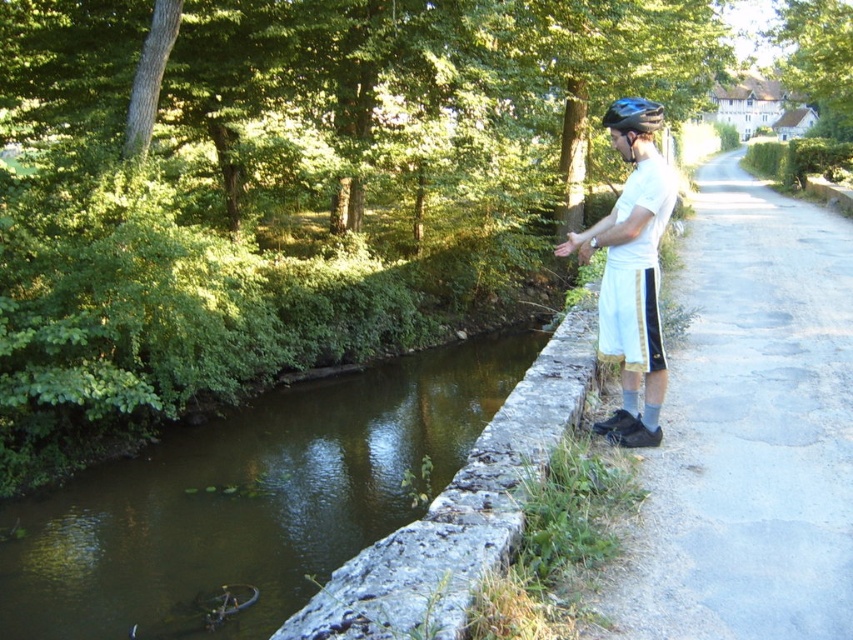
Is point (409, 451) less distant than point (607, 118)?

No, it is behind (607, 118).

Can you confirm if green mossy stone at center-left is smaller than blue matte bicycle helmet at upper center?

Yes.

The width and height of the screenshot is (853, 640). What do you see at coordinates (248, 499) in the screenshot? I see `green mossy stone at center-left` at bounding box center [248, 499].

Identify the location of green mossy stone at center-left. (248, 499).

Does gray concrete path at right appear under white cotton shorts at right?

Correct, gray concrete path at right is located below white cotton shorts at right.

Locate an element on the screen. This screenshot has width=853, height=640. gray concrete path at right is located at coordinates (749, 429).

This screenshot has height=640, width=853. In order to click on gray concrete path at right in this screenshot , I will do `click(749, 429)`.

Can you confirm if white cotton shorts at right is thinner than blue matte bicycle helmet at upper center?

Yes.

Which is above, white cotton shorts at right or blue matte bicycle helmet at upper center?

blue matte bicycle helmet at upper center is above.

The width and height of the screenshot is (853, 640). What do you see at coordinates (631, 272) in the screenshot?
I see `white cotton shorts at right` at bounding box center [631, 272].

Where is `white cotton shorts at right`? The height and width of the screenshot is (640, 853). white cotton shorts at right is located at coordinates (631, 272).